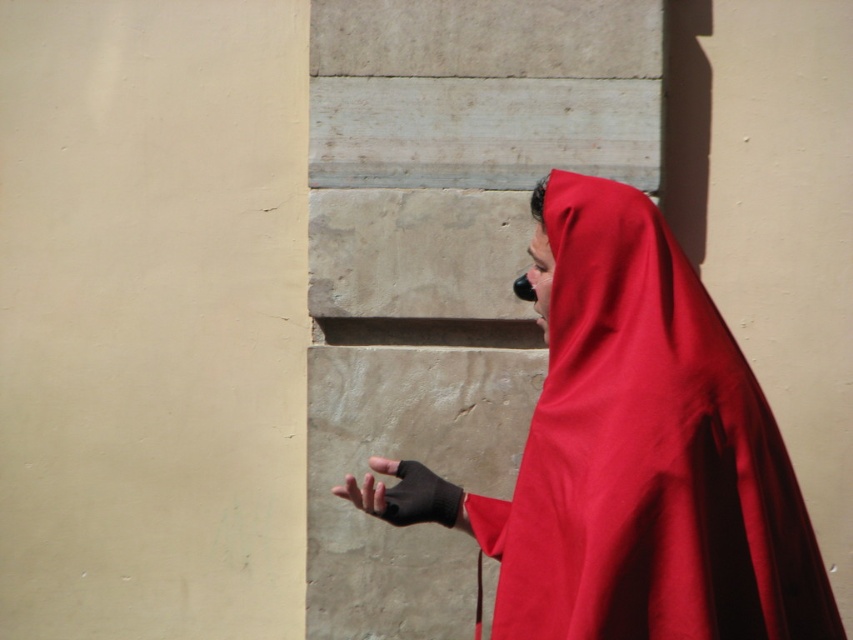
You are an artist trying to paint the scene. You need to decide which object should be painted first based on their size. According to the scene, which object should you paint first, the matte red cloak at right or the black matte glove at center?

The matte red cloak at right is larger in size than the black matte glove at center, so you should paint the matte red cloak at right first as it requires more space and attention due to its larger size.

You are an artist trying to sketch the scene. You need to place the matte red cloak at right accurately. According to the coordinates provided, where should you position it on your paper?

The matte red cloak at right should be positioned at coordinates point (x=646, y=456).